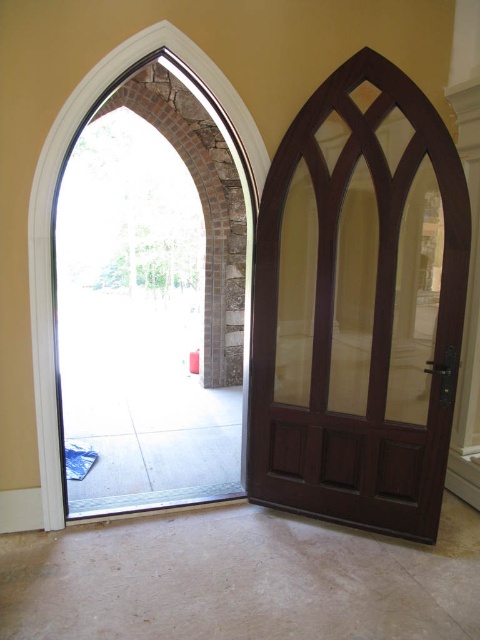
You are standing in a room with a large arched doorway leading to a garden. There is a dark brown wooden door with a gothic design to the right of the archway. You notice a point marked at coordinates (151, 301). Based on the scene, where is this point located?

The point at (151, 301) is on the clear glass door at center.

You are a delivery person with a large package that is 18 feet long. You need to move it through the clear glass door at center or the mahogany wood door at right. Which door can you use to transport the package?

Neither the clear glass door at center nor the mahogany wood door at right can be used to transport the package, as the doors are only 17.88 feet apart, which is shorter than the package length of 18 feet.